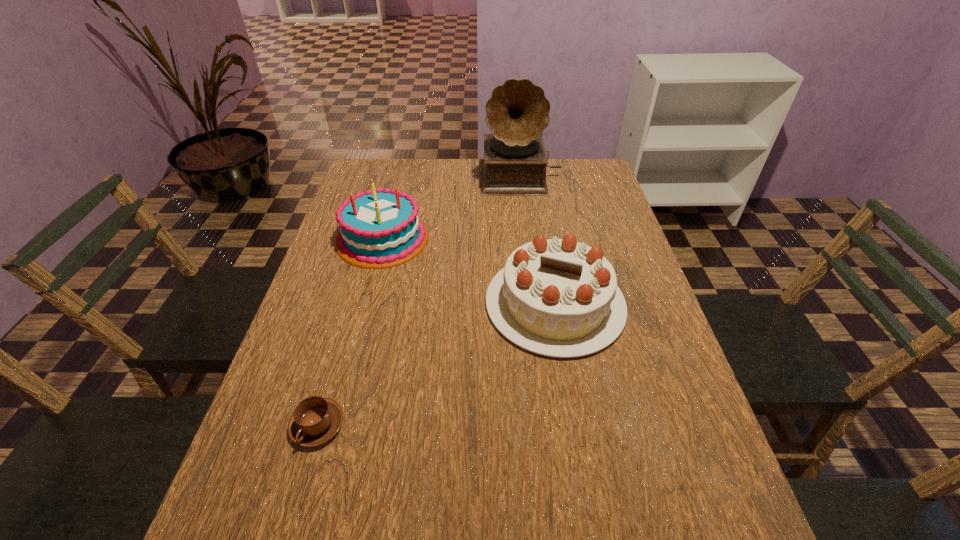
I want to click on free space at the far right corner of the desktop, so click(x=561, y=188).

Identify the location of free space between the cappuccino and the right birthday cake. (437, 364).

Locate an element on the screen. This screenshot has width=960, height=540. free space between the nearest object and the left birthday cake is located at coordinates (350, 332).

Where is `free space between the right birthday cake and the nearest object`? Image resolution: width=960 pixels, height=540 pixels. free space between the right birthday cake and the nearest object is located at coordinates (437, 364).

The width and height of the screenshot is (960, 540). I want to click on free space between the left birthday cake and the cappuccino, so click(x=350, y=332).

Where is `empty location between the left birthday cake and the shortest object`? The height and width of the screenshot is (540, 960). empty location between the left birthday cake and the shortest object is located at coordinates (350, 332).

Where is `free space between the nearest object and the record player`? The height and width of the screenshot is (540, 960). free space between the nearest object and the record player is located at coordinates (419, 301).

Locate an element on the screen. This screenshot has height=540, width=960. vacant area that lies between the right birthday cake and the left birthday cake is located at coordinates (468, 271).

You are a GUI agent. You are given a task and a screenshot of the screen. Output one action in this format:
    pyautogui.click(x=<x>, y=<y>)
    Task: Click on the second closest object to the nearest object
    Image resolution: width=960 pixels, height=540 pixels.
    Given the screenshot: What is the action you would take?
    pyautogui.click(x=381, y=228)

The height and width of the screenshot is (540, 960). Identify the location of object that ranks as the second closest to the left birthday cake. (514, 164).